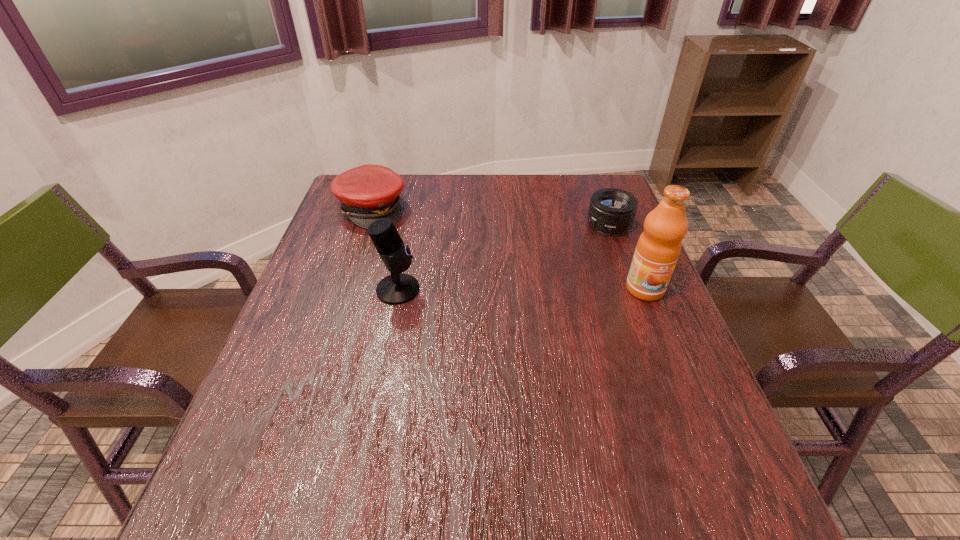
The width and height of the screenshot is (960, 540). I want to click on vacant space located 0.250m on the side of the shortest object with brand markings and control switches, so click(x=531, y=268).

Find the location of a particular element. This screenshot has width=960, height=540. vacant space located 0.100m on the side of the shortest object with brand markings and control switches is located at coordinates (570, 246).

Where is `cap situated at the far edge`? cap situated at the far edge is located at coordinates click(369, 192).

This screenshot has width=960, height=540. I want to click on telephoto lens that is at the far edge, so click(x=612, y=211).

You are a GUI agent. You are given a task and a screenshot of the screen. Output one action in this format:
    pyautogui.click(x=<x>, y=<y>)
    Task: Click on the object present at the left edge
    
    Given the screenshot: What is the action you would take?
    pyautogui.click(x=369, y=192)

Locate an element on the screen. The image size is (960, 540). fruit juice present at the right edge is located at coordinates (658, 248).

Image resolution: width=960 pixels, height=540 pixels. I want to click on telephoto lens that is positioned at the right edge, so click(612, 211).

You are a GUI agent. You are given a task and a screenshot of the screen. Output one action in this format:
    pyautogui.click(x=<x>, y=<y>)
    Task: Click on the object located in the far left corner section of the desktop
    This screenshot has width=960, height=540.
    Given the screenshot: What is the action you would take?
    pyautogui.click(x=369, y=192)

Find the location of a particular element. object present at the far right corner is located at coordinates (612, 211).

In the image, there is a desktop. At what (x,y) coordinates should I click in order to perform the action: click on vacant space at the far edge. Please return your answer as a coordinate pair (x, y). Looking at the image, I should click on (535, 213).